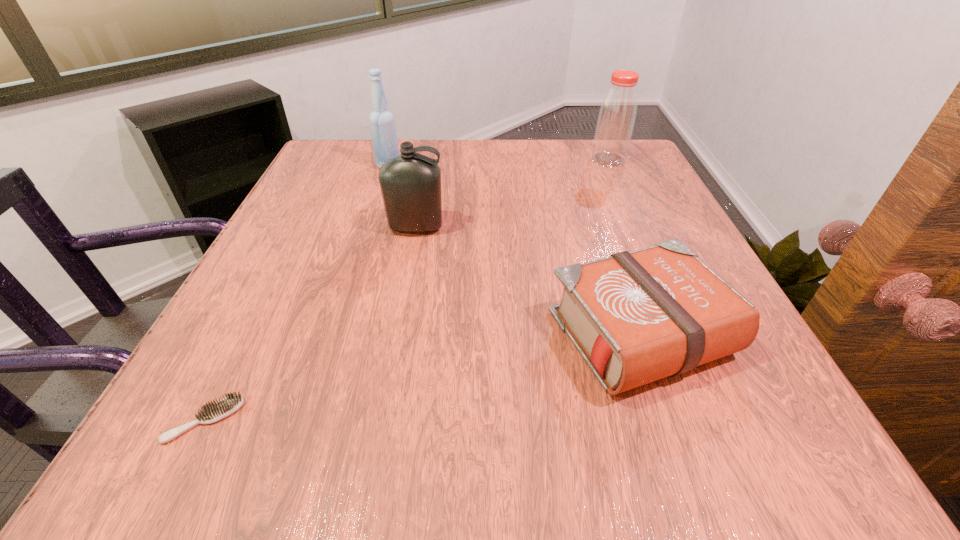
Locate an element on the screen. the leftmost bottle is located at coordinates (382, 123).

Where is `the rightmost bottle`? the rightmost bottle is located at coordinates (617, 114).

Image resolution: width=960 pixels, height=540 pixels. Identify the location of the third tallest object. (410, 184).

Locate an element on the screen. the third object from right to left is located at coordinates (410, 184).

At what (x,y) coordinates should I click in order to perform the action: click on the second shortest object. Please return your answer as a coordinate pair (x, y). This screenshot has height=540, width=960. Looking at the image, I should click on (635, 317).

At what (x,y) coordinates should I click in order to perform the action: click on the leftmost object. Please return your answer as a coordinate pair (x, y). Looking at the image, I should click on (214, 411).

The width and height of the screenshot is (960, 540). Identify the location of the shortest object. (214, 411).

The width and height of the screenshot is (960, 540). In order to click on free space located 0.370m on the front of the second object from left to right in this screenshot , I will do `click(354, 273)`.

Identify the location of free location located on the front of the rightmost bottle. (660, 274).

Identify the location of vacant area situated 0.060m on the back of the third nearest object. Image resolution: width=960 pixels, height=540 pixels. (421, 201).